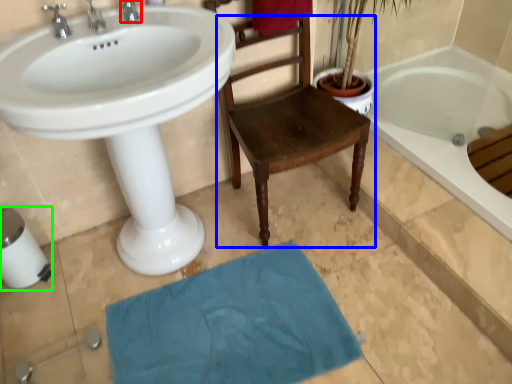
Question: Based on their relative distances, which object is nearer to tap (highlighted by a red box)? Choose from chair (highlighted by a blue box) and toilet paper (highlighted by a green box).

Choices:
 (A) chair
 (B) toilet paper

Answer: (A)